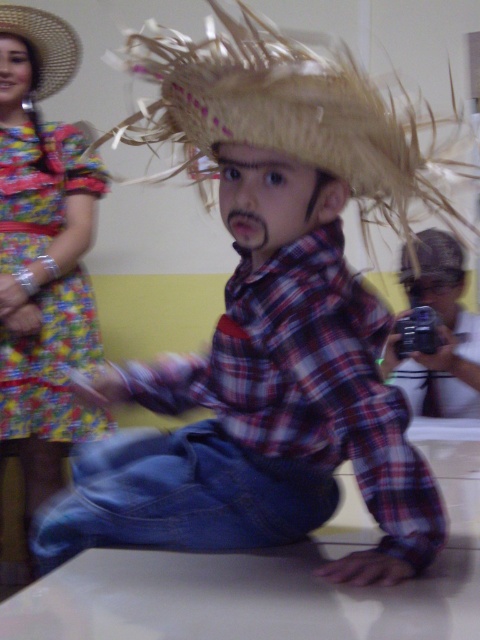
You are a photographer trying to capture the scene with the straw at center and the natural straw hat at upper left. Which object should you focus on first if you want to ensure both are in focus?

The natural straw hat at upper left is above the straw at center, so focusing on the natural straw hat at upper left first would help ensure both are in focus as it is farther away.

You are standing in front of the image and want to touch the two points shown. Which point is closer to you, point (229,90) or point (47,24)?

Point (229,90) is closer to the viewer than point (47,24).

You are standing in front of a table where a child is sitting. Where is the floral fabric dress at left located in the image?

The floral fabric dress at left is located at point (51, 365) in the image.